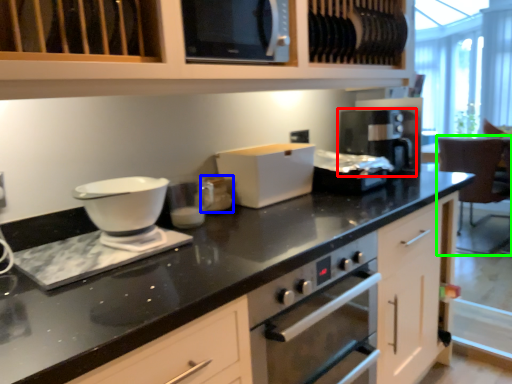
Question: Estimate the real-world distances between objects in this image. Which object is closer to coffee machine (highlighted by a red box), appliance (highlighted by a blue box) or chair (highlighted by a green box)?

Choices:
 (A) appliance
 (B) chair

Answer: (A)